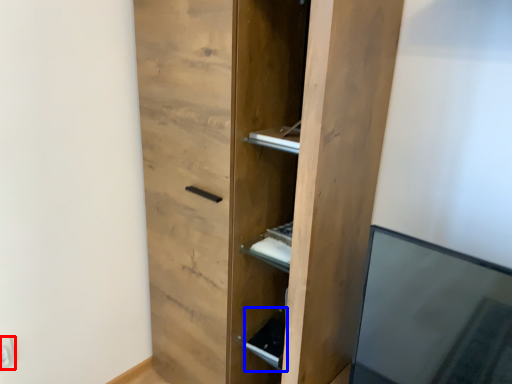
Question: Which of the following is the farthest to the observer, electric outlet (highlighted by a red box) or cabinet (highlighted by a blue box)?

Choices:
 (A) electric outlet
 (B) cabinet

Answer: (B)